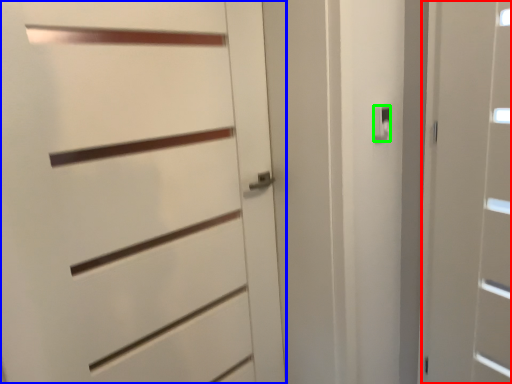
Question: Based on their relative distances, which object is farther from door (highlighted by a red box)? Choose from door (highlighted by a blue box) and latch (highlighted by a green box).

Choices:
 (A) door
 (B) latch

Answer: (A)